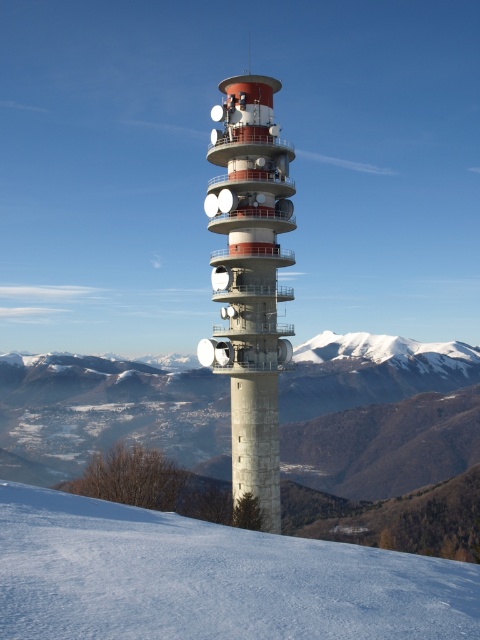
Question: Does white snow at lower center appear on the left side of concrete tower at center?

Choices:
 (A) no
 (B) yes

Answer: (A)

Question: Which point is closer to the camera?

Choices:
 (A) (459, 580)
 (B) (264, 122)

Answer: (A)

Question: Which point is farther from the camera taking this photo?

Choices:
 (A) (224, 298)
 (B) (374, 580)

Answer: (A)

Question: From the image, what is the correct spatial relationship of white snow at lower center in relation to concrete tower at center?

Choices:
 (A) left
 (B) right

Answer: (B)

Question: Is white snow at lower center behind concrete tower at center?

Choices:
 (A) yes
 (B) no

Answer: (B)